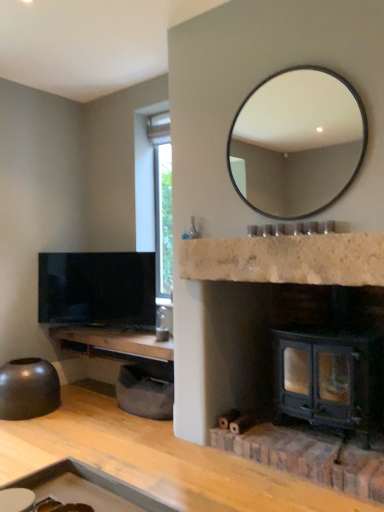
Where is `vacant space underneath matte black tv at left (from a real-world perspective)`? The image size is (384, 512). vacant space underneath matte black tv at left (from a real-world perspective) is located at coordinates (103, 331).